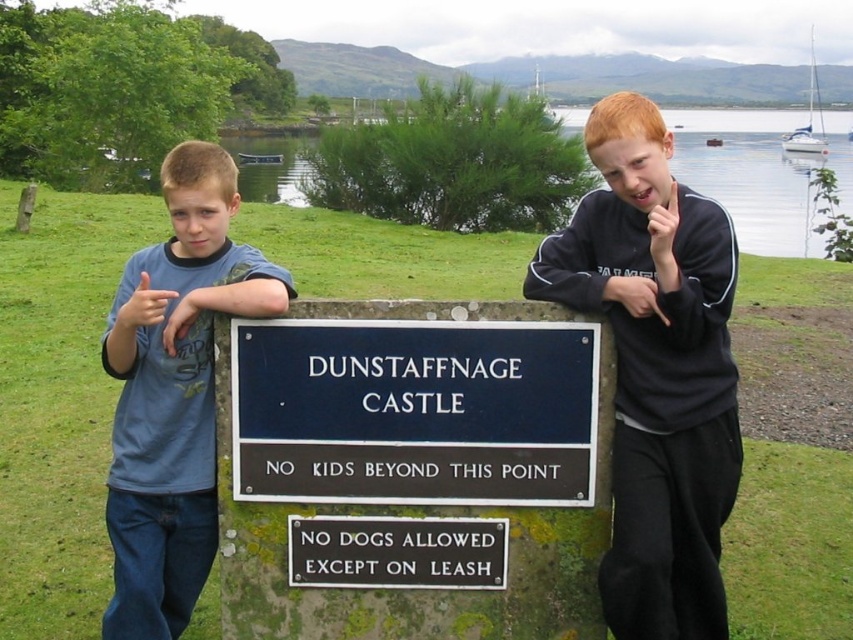
Does dark blue metal sign at center have a larger size compared to black metal sign at center?

Yes, dark blue metal sign at center is bigger than black metal sign at center.

Who is higher up, dark blue metal sign at center or black metal sign at center?

dark blue metal sign at center is higher up.

From the picture: Who is more distant from viewer, [543,388] or [395,522]?

Positioned behind is point [395,522].

Identify the location of dark blue metal sign at center. (415, 412).

The width and height of the screenshot is (853, 640). Describe the element at coordinates (654, 369) in the screenshot. I see `black fleece at right` at that location.

Looking at this image, is black fleece at right wider than blue t-shirt at left?

Incorrect, black fleece at right's width does not surpass blue t-shirt at left's.

Find the location of a particular element. This screenshot has width=853, height=640. black fleece at right is located at coordinates click(654, 369).

From the picture: Is dark blue metal sign at center closer to the viewer compared to blue t-shirt at left?

No, dark blue metal sign at center is behind blue t-shirt at left.

Is point (247, 490) positioned before point (160, 266)?

Yes, it is.

I want to click on dark blue metal sign at center, so click(415, 412).